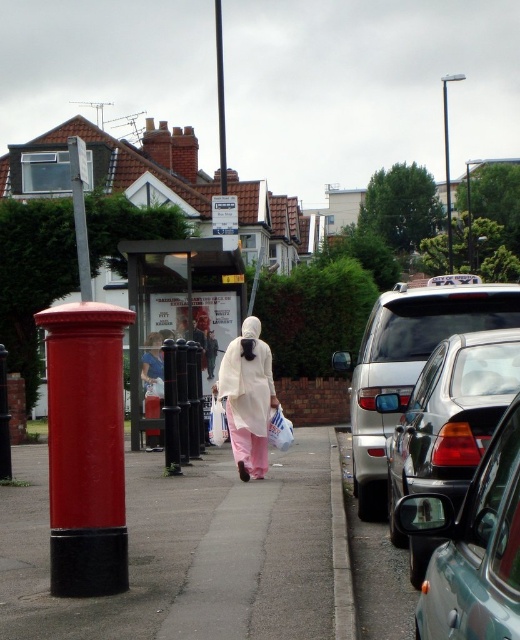
Question: Which object appears farthest from the camera in this image?

Choices:
 (A) metallic silver car at right
 (B) shiny silver taxi at right
 (C) white matte dress at center
 (D) smooth black pole at center

Answer: (D)

Question: Is shiny silver taxi at right to the right of white matte dress at center from the viewer's perspective?

Choices:
 (A) yes
 (B) no

Answer: (A)

Question: Which point appears farthest from the camera in this image?

Choices:
 (A) (214, 8)
 (B) (341, 476)

Answer: (A)

Question: Is matte red postbox at left bigger than metallic silver car at right?

Choices:
 (A) yes
 (B) no

Answer: (B)

Question: Among these objects, which one is farthest from the camera?

Choices:
 (A) gray concrete curb at lower center
 (B) matte red postbox at left

Answer: (B)

Question: Is matte red postbox at left behind metallic silver car at right?

Choices:
 (A) no
 (B) yes

Answer: (B)